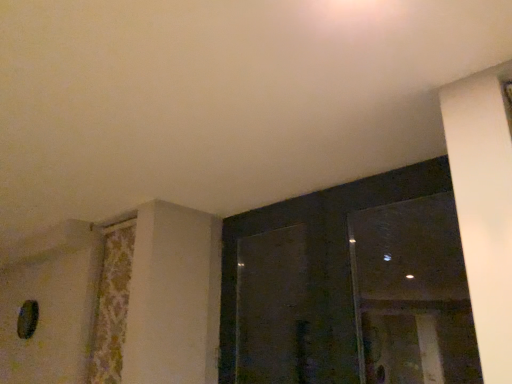
Identify the location of transparent glass window at upper right, arranged as the second window when viewed from the right. (350, 286).

Image resolution: width=512 pixels, height=384 pixels. Identify the location of transparent glass window at upper right, acting as the second window starting from the left. (412, 294).

Does transparent glass window at upper right, acting as the second window starting from the left, turn towards transparent glass screen door at center?

No, transparent glass window at upper right, acting as the second window starting from the left, is not oriented towards transparent glass screen door at center.

Considering their positions, is transparent glass window at upper right, the 1th window viewed from the right, located in front of or behind transparent glass screen door at center?

transparent glass window at upper right, the 1th window viewed from the right, is positioned closer to the viewer than transparent glass screen door at center.

Which object is positioned more to the right, transparent glass window at upper right, the 1th window viewed from the right, or transparent glass screen door at center?

Positioned to the right is transparent glass window at upper right, the 1th window viewed from the right.

From a real-world perspective, between transparent glass window at upper right, the 1th window viewed from the right, and transparent glass screen door at center, who is vertically lower?

In real-world perspective, transparent glass screen door at center is lower.

Considering the sizes of objects transparent glass window at upper right, the 1th window viewed from the right, and transparent glass window at upper right, arranged as the second window when viewed from the right, in the image provided, who is taller, transparent glass window at upper right, the 1th window viewed from the right, or transparent glass window at upper right, arranged as the second window when viewed from the right,?

transparent glass window at upper right, arranged as the second window when viewed from the right, is taller.

Considering the positions of objects transparent glass window at upper right, acting as the second window starting from the left, and transparent glass window at upper right, arranged as the second window when viewed from the right, in the image provided, who is more to the left, transparent glass window at upper right, acting as the second window starting from the left, or transparent glass window at upper right, arranged as the second window when viewed from the right,?

Positioned to the left is transparent glass window at upper right, arranged as the second window when viewed from the right.

Which is in front, transparent glass window at upper right, acting as the second window starting from the left, or transparent glass window at upper right, arranged as the second window when viewed from the right?

transparent glass window at upper right, arranged as the second window when viewed from the right.

Is transparent glass window at upper right, the 1th window viewed from the right, next to transparent glass window at upper right, arranged as the second window when viewed from the right?

No.

Considering the points (251, 260) and (284, 358), which point is in front, point (251, 260) or point (284, 358)?

Point (284, 358)

Is transparent glass screen door at center to the left or to the right of transparent glass window at upper right, acting as the first window starting from the left, in the image?

In the image, transparent glass screen door at center appears on the left side of transparent glass window at upper right, acting as the first window starting from the left.

Is transparent glass screen door at center facing towards transparent glass window at upper right, arranged as the second window when viewed from the right?

Yes, transparent glass screen door at center faces towards transparent glass window at upper right, arranged as the second window when viewed from the right.

How many degrees apart are the facing directions of floral fabric curtain at left and transparent glass window at upper right, acting as the second window starting from the left?

The facing directions of floral fabric curtain at left and transparent glass window at upper right, acting as the second window starting from the left, are 1.13 degrees apart.

From the image's perspective, relative to transparent glass window at upper right, the 1th window viewed from the right, is floral fabric curtain at left above or below?

Clearly, from the image's perspective, floral fabric curtain at left is below transparent glass window at upper right, the 1th window viewed from the right.

Is transparent glass window at upper right, acting as the second window starting from the left, at the back of floral fabric curtain at left?

floral fabric curtain at left does not have its back to transparent glass window at upper right, acting as the second window starting from the left.

Consider the image. Are floral fabric curtain at left and transparent glass window at upper right, the 1th window viewed from the right, far apart?

Absolutely, floral fabric curtain at left is distant from transparent glass window at upper right, the 1th window viewed from the right.

Which of these two, transparent glass window at upper right, acting as the first window starting from the left, or floral fabric curtain at left, is thinner?

With smaller width is floral fabric curtain at left.

From the image's perspective, is transparent glass window at upper right, acting as the first window starting from the left, beneath floral fabric curtain at left?

Incorrect, from the image's perspective, transparent glass window at upper right, acting as the first window starting from the left, is higher than floral fabric curtain at left.

Between transparent glass window at upper right, arranged as the second window when viewed from the right, and floral fabric curtain at left, which one has larger size?

transparent glass window at upper right, arranged as the second window when viewed from the right.

Who is taller, floral fabric curtain at left or transparent glass screen door at center?

floral fabric curtain at left.

Considering the sizes of objects floral fabric curtain at left and transparent glass screen door at center in the image provided, who is thinner, floral fabric curtain at left or transparent glass screen door at center?

floral fabric curtain at left is thinner.

Identify the location of screen door above the floral fabric curtain at left (from a real-world perspective). (273, 308).

From the image's perspective, which is below, floral fabric curtain at left or transparent glass screen door at center?

floral fabric curtain at left is shown below in the image.

Is transparent glass screen door at center in front of or behind transparent glass window at upper right, acting as the second window starting from the left, in the image?

Visually, transparent glass screen door at center is located behind transparent glass window at upper right, acting as the second window starting from the left.

Is transparent glass screen door at center wider than transparent glass window at upper right, the 1th window viewed from the right?

Correct, the width of transparent glass screen door at center exceeds that of transparent glass window at upper right, the 1th window viewed from the right.

Does transparent glass screen door at center have a lesser height compared to transparent glass window at upper right, acting as the second window starting from the left?

No, transparent glass screen door at center is not shorter than transparent glass window at upper right, acting as the second window starting from the left.

You are a GUI agent. You are given a task and a screenshot of the screen. Output one action in this format:
    pyautogui.click(x=<x>, y=<y>)
    Task: Click on the screen door below the transparent glass window at upper right, the 1th window viewed from the right (from a real-world perspective)
    The width and height of the screenshot is (512, 384).
    Given the screenshot: What is the action you would take?
    pyautogui.click(x=273, y=308)

Identify the location of the 2nd window above the transparent glass screen door at center (from the image's perspective). Image resolution: width=512 pixels, height=384 pixels. (412, 294).

Where is `window above the transparent glass window at upper right, acting as the first window starting from the left (from a real-world perspective)`? window above the transparent glass window at upper right, acting as the first window starting from the left (from a real-world perspective) is located at coordinates click(x=412, y=294).

Looking at the image, which one is located further to transparent glass window at upper right, the 1th window viewed from the right, transparent glass window at upper right, arranged as the second window when viewed from the right, or floral fabric curtain at left?

floral fabric curtain at left lies further to transparent glass window at upper right, the 1th window viewed from the right, than the other object.

When comparing their distances from transparent glass screen door at center, does floral fabric curtain at left or transparent glass window at upper right, acting as the first window starting from the left, seem closer?

transparent glass window at upper right, acting as the first window starting from the left, is positioned closer to the anchor transparent glass screen door at center.

Based on the photo, based on their spatial positions, is transparent glass window at upper right, acting as the first window starting from the left, or transparent glass window at upper right, acting as the second window starting from the left, further from floral fabric curtain at left?

transparent glass window at upper right, acting as the second window starting from the left, is positioned further to the anchor floral fabric curtain at left.

Based on the photo, estimate the real-world distances between objects in this image. Which object is further from floral fabric curtain at left, transparent glass window at upper right, arranged as the second window when viewed from the right, or transparent glass screen door at center?

transparent glass window at upper right, arranged as the second window when viewed from the right.

Looking at the image, which one is located further to transparent glass screen door at center, transparent glass window at upper right, the 1th window viewed from the right, or floral fabric curtain at left?

Among the two, floral fabric curtain at left is located further to transparent glass screen door at center.

Based on their spatial positions, is transparent glass window at upper right, acting as the first window starting from the left, or transparent glass window at upper right, acting as the second window starting from the left, closer to transparent glass screen door at center?

Based on the image, transparent glass window at upper right, acting as the first window starting from the left, appears to be nearer to transparent glass screen door at center.

Which object lies nearer to the anchor point transparent glass window at upper right, acting as the first window starting from the left, transparent glass window at upper right, the 1th window viewed from the right, or transparent glass screen door at center?

transparent glass window at upper right, the 1th window viewed from the right, is closer to transparent glass window at upper right, acting as the first window starting from the left.

Which object lies nearer to the anchor point transparent glass window at upper right, acting as the first window starting from the left, transparent glass screen door at center or floral fabric curtain at left?

transparent glass screen door at center is closer to transparent glass window at upper right, acting as the first window starting from the left.

In order to click on screen door between floral fabric curtain at left and transparent glass window at upper right, arranged as the second window when viewed from the right in this screenshot , I will do `click(273, 308)`.

Identify the location of window between floral fabric curtain at left and transparent glass window at upper right, acting as the second window starting from the left, in the horizontal direction. The height and width of the screenshot is (384, 512). (350, 286).

This screenshot has width=512, height=384. I want to click on window between transparent glass screen door at center and transparent glass window at upper right, the 1th window viewed from the right, in the horizontal direction, so click(x=350, y=286).

Locate an element on the screen. The width and height of the screenshot is (512, 384). screen door between floral fabric curtain at left and transparent glass window at upper right, acting as the second window starting from the left is located at coordinates (273, 308).